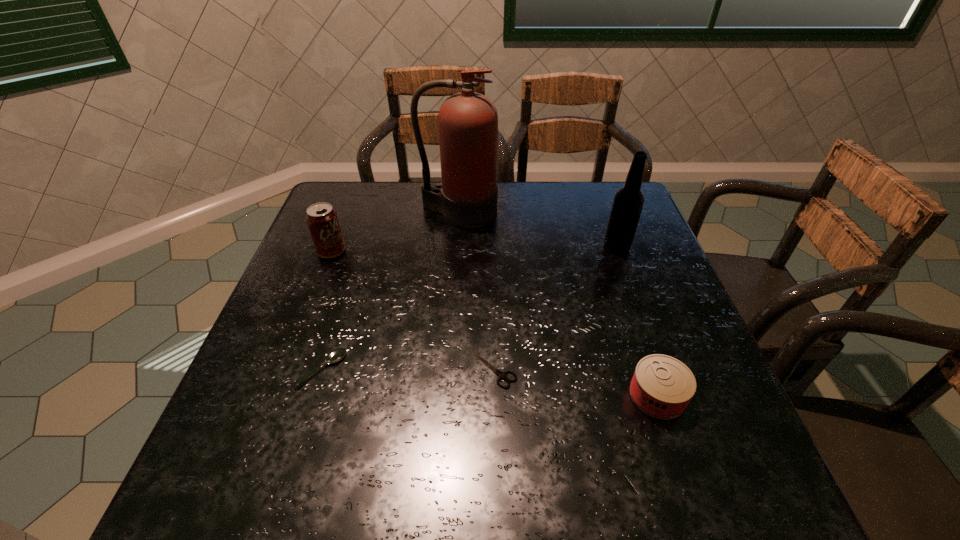
Identify the location of the farthest object. Image resolution: width=960 pixels, height=540 pixels. (468, 121).

Where is `fire extinguisher`? The height and width of the screenshot is (540, 960). fire extinguisher is located at coordinates (468, 121).

This screenshot has height=540, width=960. Identify the location of beer bottle. (628, 202).

Locate an element on the screen. This screenshot has width=960, height=540. soda can is located at coordinates (322, 220).

At what (x,y) coordinates should I click in order to perform the action: click on can. Please return your answer as a coordinate pair (x, y). Looking at the image, I should click on (662, 386).

Find the location of `soupspoon`. soupspoon is located at coordinates (336, 355).

The image size is (960, 540). I want to click on shears, so click(x=501, y=375).

Where is `free space located at the nozzle of the fire extinguisher`? This screenshot has height=540, width=960. free space located at the nozzle of the fire extinguisher is located at coordinates (452, 307).

Where is `vacant space situated on the back of the beer bottle`? vacant space situated on the back of the beer bottle is located at coordinates (597, 193).

The height and width of the screenshot is (540, 960). Identify the location of vacant region located on the right of the third tallest object. (496, 252).